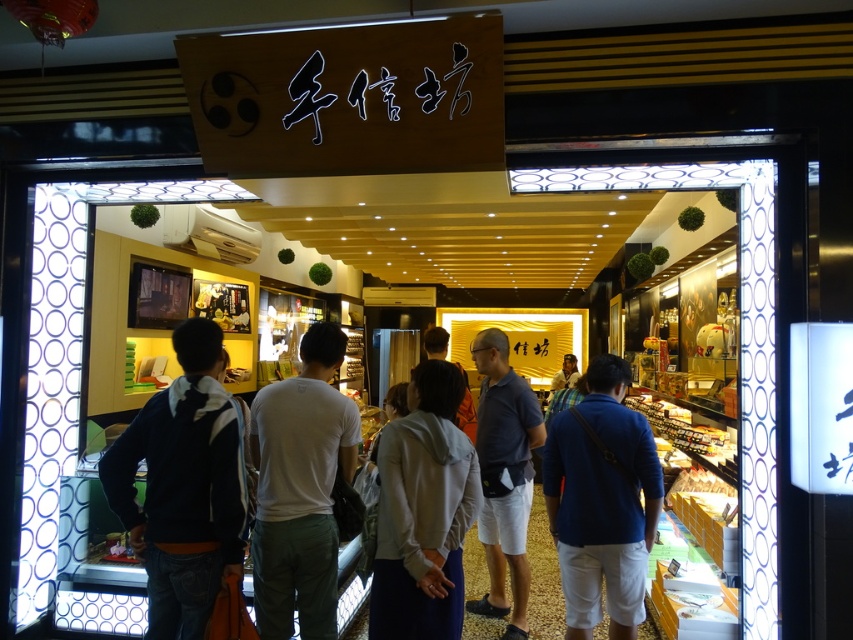
Question: Where is dark blue hoodie at left located in relation to white cotton t-shirt at center in the image?

Choices:
 (A) left
 (B) right

Answer: (A)

Question: Which object appears farthest from the camera in this image?

Choices:
 (A) dark blue hoodie at left
 (B) light brown leather jacket at center
 (C) white cotton t-shirt at center
 (D) blue cotton shirt at center

Answer: (D)

Question: Among these points, which one is nearest to the camera?

Choices:
 (A) (408, 556)
 (B) (138, 429)

Answer: (B)

Question: Is dark blue hoodie at left bigger than light gray fabric jacket at center?

Choices:
 (A) yes
 (B) no

Answer: (A)

Question: Among these objects, which one is nearest to the camera?

Choices:
 (A) light brown leather jacket at center
 (B) light gray fabric jacket at center
 (C) white cotton t-shirt at center

Answer: (B)

Question: Does dark blue hoodie at left appear over light brown leather jacket at center?

Choices:
 (A) no
 (B) yes

Answer: (A)